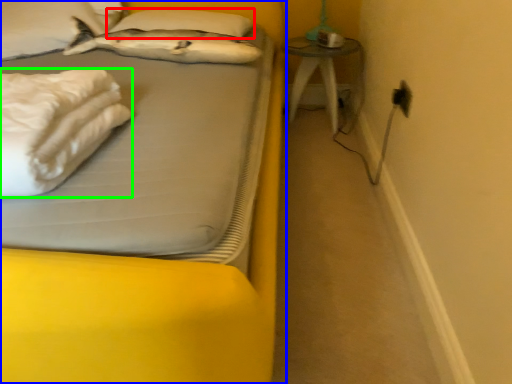
Question: Which object is positioned closest to pillow (highlighted by a red box)? Select from bed (highlighted by a blue box) and material (highlighted by a green box).

Choices:
 (A) bed
 (B) material

Answer: (B)